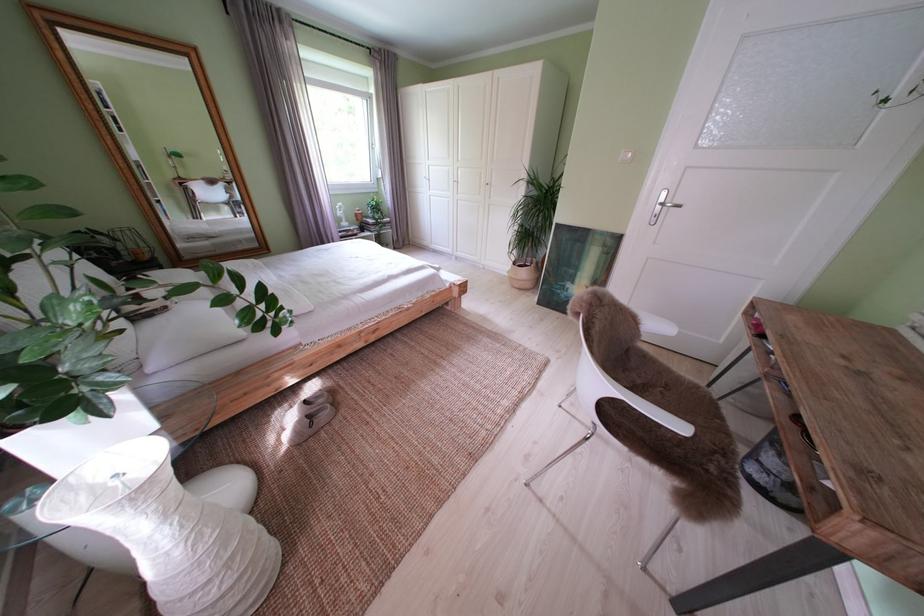
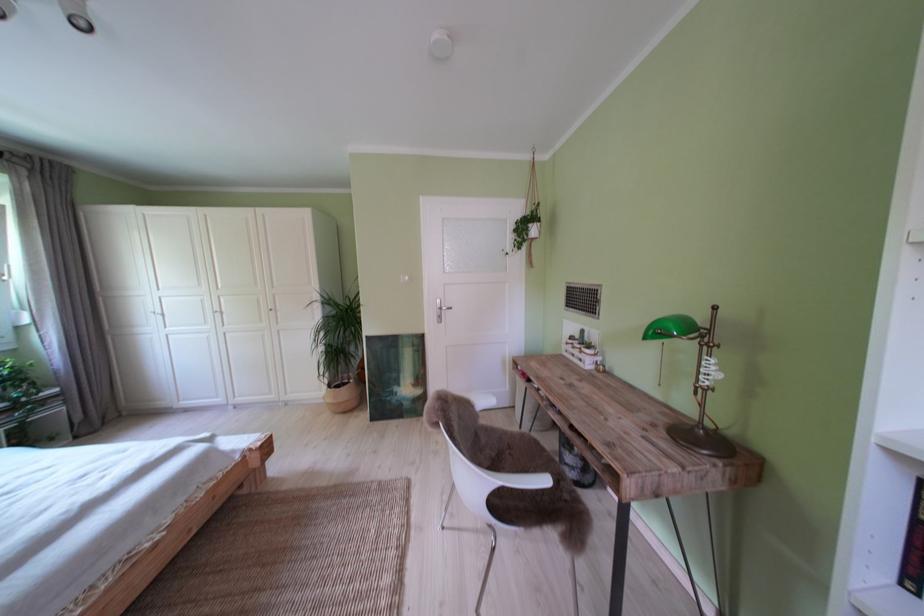
The point at (570, 297) is marked in the first image. Where is the corresponding point in the second image?

(399, 403)